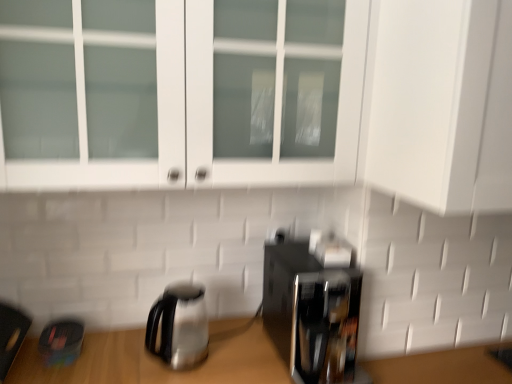
Question: Considering the relative positions of white glass cabinet at upper center and stainless steel kettle at lower left in the image provided, is white glass cabinet at upper center to the left or to the right of stainless steel kettle at lower left?

Choices:
 (A) right
 (B) left

Answer: (A)

Question: From their relative heights in the image, would you say white glass cabinet at upper center is taller or shorter than stainless steel kettle at lower left?

Choices:
 (A) short
 (B) tall

Answer: (B)

Question: Which object is the closest to the white glass cabinet at upper center?

Choices:
 (A) black glossy coffee maker at lower right
 (B) stainless steel kettle at lower left

Answer: (A)

Question: Which object is positioned closest to the black glossy coffee maker at lower right?

Choices:
 (A) stainless steel kettle at lower left
 (B) white glass cabinet at upper center

Answer: (A)